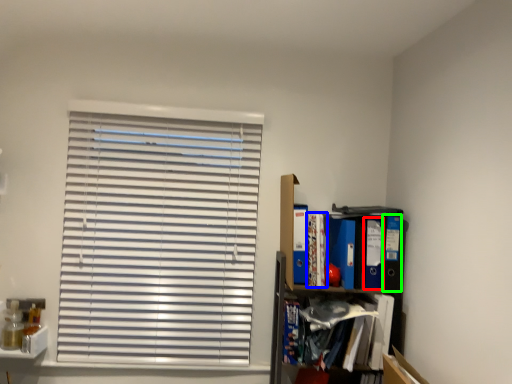
Question: Considering the real-world distances, which object is farthest from paperback book (highlighted by a red box)? book (highlighted by a blue box) or paperback book (highlighted by a green box)?

Choices:
 (A) book
 (B) paperback book

Answer: (A)